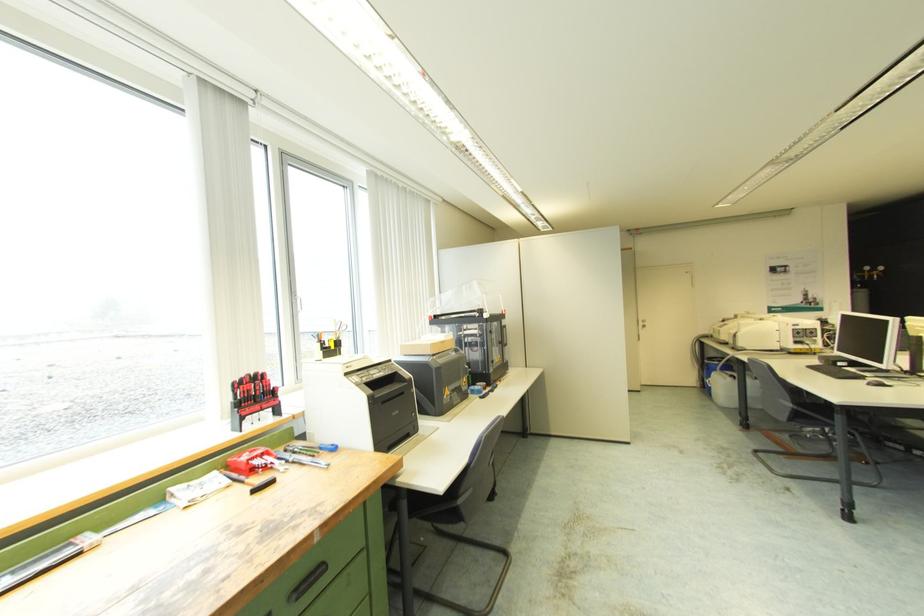
In order to click on small cardboard box in this screenshot , I will do `click(428, 344)`.